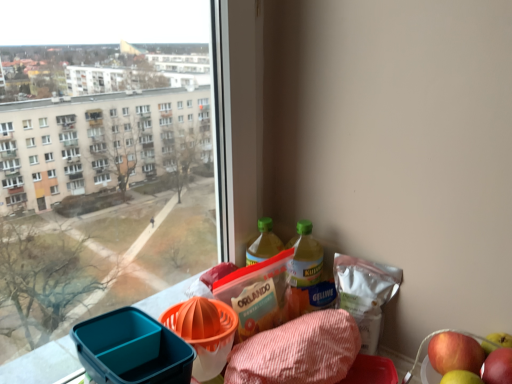
At what (x,y) coordinates should I click in order to perform the action: click on green plastic bottle at upper right. Please return your answer as a coordinate pair (x, y). This screenshot has width=512, height=384. Looking at the image, I should click on (309, 271).

The image size is (512, 384). What do you see at coordinates (309, 271) in the screenshot? I see `green plastic bottle at upper right` at bounding box center [309, 271].

This screenshot has height=384, width=512. In order to click on green plastic bottle at upper right in this screenshot , I will do `click(309, 271)`.